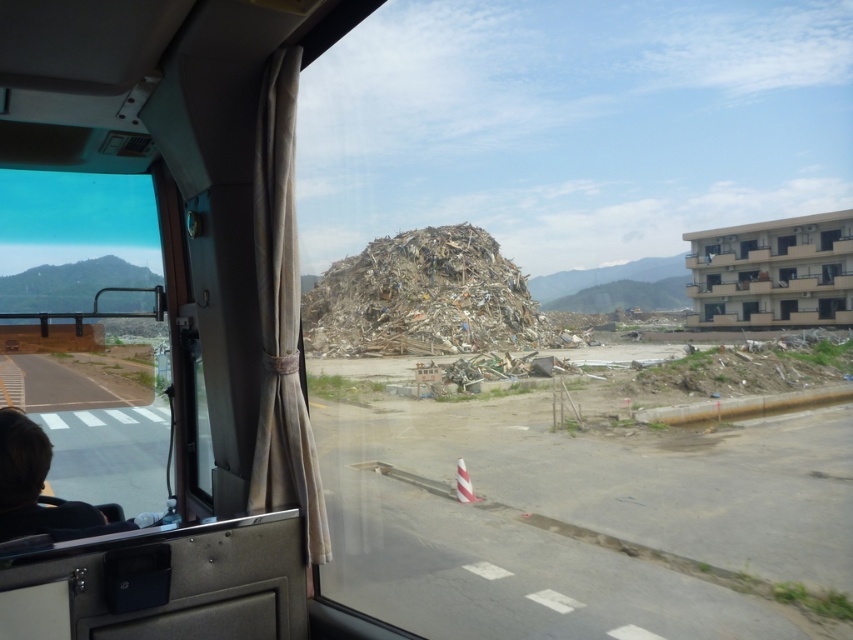
You are sitting in the vehicle and looking through the window. There are two points marked on the window glass. The first point is at coordinate point [9,538] and the second point is at coordinate point [833,230]. Which point is closer to your eyes?

Point [9,538] is closer to the camera than point [833,230], so the first point is closer to your eyes.

You are a delivery driver who needs to navigate around the brown shredded debris at center. Based on the coordinates provided, can you determine if the debris is positioned closer to the left or right side of the vehicle?

The brown shredded debris at center is located at coordinates approximately 0.466 on the x and 0.495 on the y. Since the center of the vehicle would be at 0.5 on both axes, the debris is slightly to the right of the vehicle.

You are inside a vehicle and looking at the scene outside. There is a point at coordinates (32, 483). What object is located at this point?

The dark brown hair at lower left is located at point (32, 483).